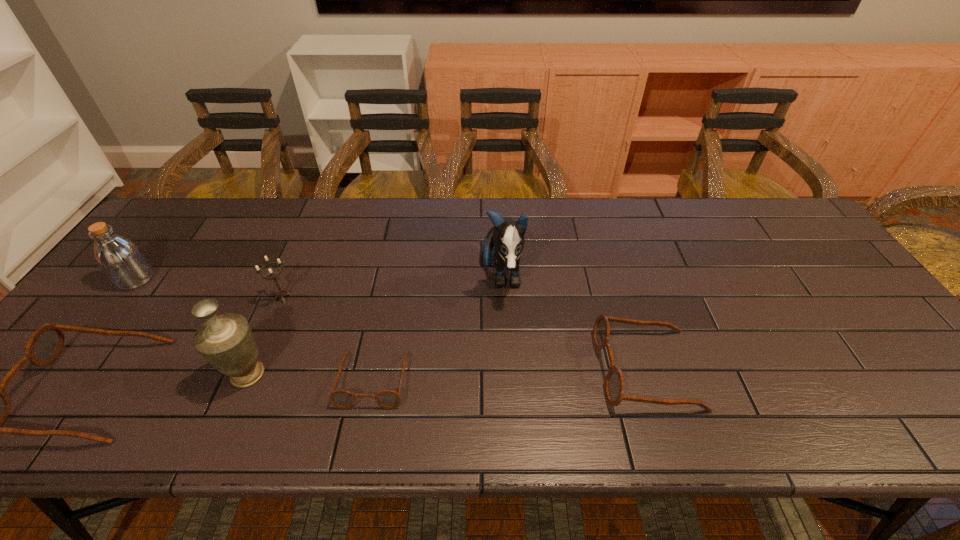
You are a GUI agent. You are given a task and a screenshot of the screen. Output one action in this format:
    pyautogui.click(x=<x>, y=<y>)
    Task: Click on the blank area located on the front-facing side of the rightmost spectacles
    Image resolution: width=960 pixels, height=540 pixels.
    Given the screenshot: What is the action you would take?
    pyautogui.click(x=546, y=369)

The image size is (960, 540). Find the location of `vacant area situated 0.360m on the front-facing side of the rightmost spectacles`. vacant area situated 0.360m on the front-facing side of the rightmost spectacles is located at coordinates (443, 369).

Where is `free space located 0.070m on the front-facing side of the tallest object`? The width and height of the screenshot is (960, 540). free space located 0.070m on the front-facing side of the tallest object is located at coordinates (505, 332).

Find the location of a particular element. Image resolution: width=960 pixels, height=540 pixels. vacant space located 0.300m on the left of the fourth tallest object is located at coordinates (159, 298).

This screenshot has height=540, width=960. What are the coordinates of `vacant space located 0.180m on the front of the bottle` in the screenshot? It's located at (84, 347).

Image resolution: width=960 pixels, height=540 pixels. I want to click on free space located on the back of the urn, so click(283, 294).

Identify the location of urn located in the near edge section of the desktop. (226, 341).

This screenshot has height=540, width=960. I want to click on object that is at the left edge, so click(x=122, y=261).

Locate an element on the screen. free space at the far edge of the desktop is located at coordinates (661, 199).

You are a GUI agent. You are given a task and a screenshot of the screen. Output one action in this format:
    pyautogui.click(x=<x>, y=<y>)
    Task: Click on the vacant region at the right edge of the desktop
    
    Given the screenshot: What is the action you would take?
    pyautogui.click(x=873, y=343)